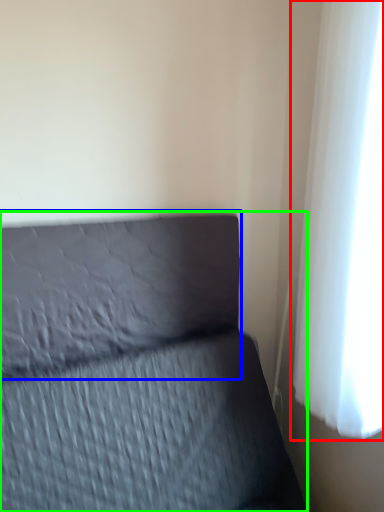
Question: Which object is positioned farthest from curtain (highlighted by a red box)? Select from pillow (highlighted by a blue box) and furniture (highlighted by a green box).

Choices:
 (A) pillow
 (B) furniture

Answer: (A)